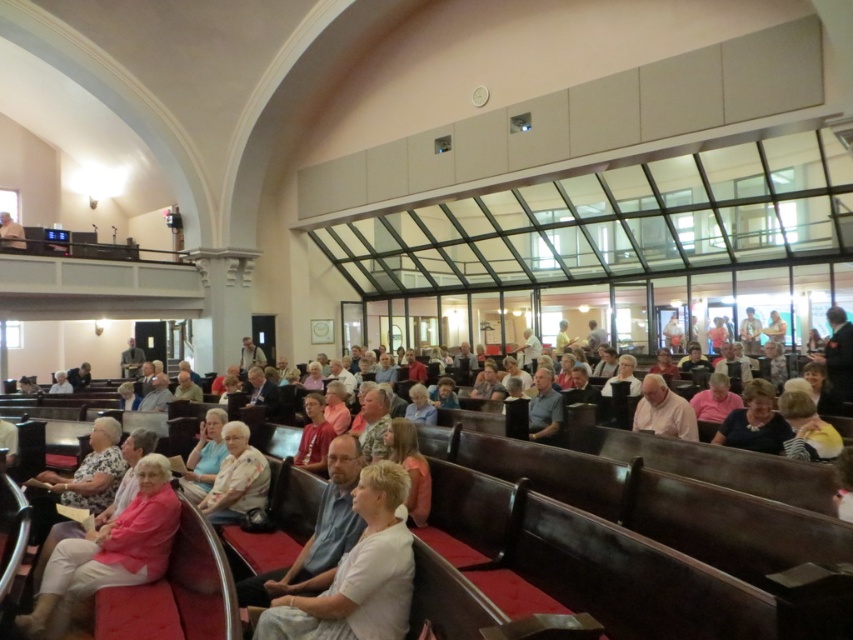
From the picture: You are standing at the front of the church and want to move to the point that is closer to you. Which point should you head towards, point (x=532, y=397) or point (x=9, y=244)?

Point (x=532, y=397) is closer to the viewer than point (x=9, y=244), so you should head towards point (x=532, y=397).

You are a photographer standing at the back of the church. You need to take a photo of the light beige fabric jacket at center and the light beige fabric chair at lower left. From your position, which object is located to the right of the other?

The light beige fabric jacket at center is positioned on the right side of the light beige fabric chair at lower left, so from your position at the back, the jacket is to the right of the chair.

You are organizing a small event in the church and need to place a light beige fabric jacket at center and a light beige fabric chair at lower left. Given their sizes, which one can be placed in a tighter space?

The light beige fabric jacket at center has a smaller size compared to the light beige fabric chair at lower left, so it can be placed in a tighter space.